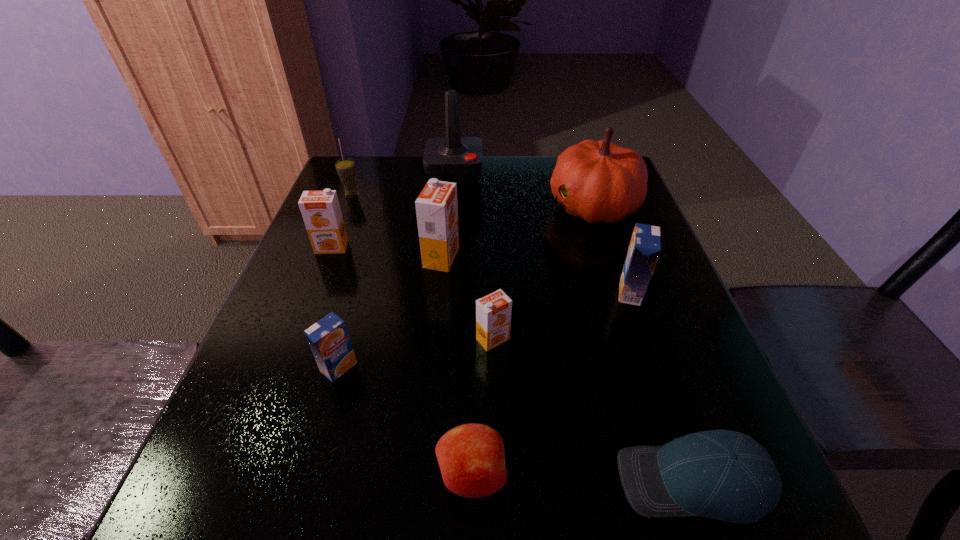
Locate which orange orange juice ranks in proximity to the left blue orange_juice. Please provide its 2D coordinates. Your answer should be formatted as a tuple, i.e. [(x, y)], where the tuple contains the x and y coordinates of a point satisfying the conditions above.

[(493, 312)]

Locate an element on the screen. The width and height of the screenshot is (960, 540). vacant point that satisfies the following two spatial constraints: 1. on the front side of the smaller blue orange_juice; 2. on the left side of the second shortest object is located at coordinates (309, 475).

The image size is (960, 540). In order to click on vacant region that satisfies the following two spatial constraints: 1. on the front-facing side of the pink pumpkin; 2. on the left side of the baseball cap in this screenshot , I will do `click(685, 481)`.

Locate an element on the screen. The image size is (960, 540). free space that satisfies the following two spatial constraints: 1. on the front side of the second orange orange juice from left to right; 2. on the left side of the yellow straw for drinking is located at coordinates (326, 258).

Find the location of a particular element. This screenshot has height=540, width=960. free location that satisfies the following two spatial constraints: 1. on the front side of the second biggest orange orange juice; 2. on the right side of the third nearest orange juice is located at coordinates (315, 292).